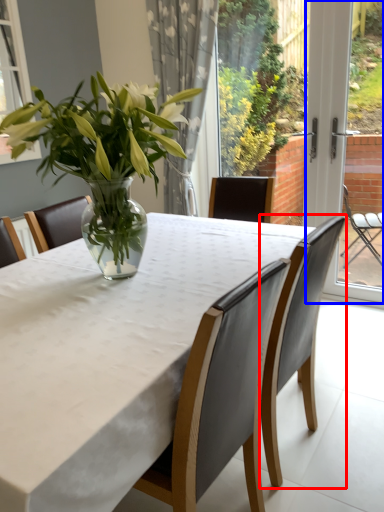
Question: Among these objects, which one is farthest to the camera, chair (highlighted by a red box) or screen door (highlighted by a blue box)?

Choices:
 (A) chair
 (B) screen door

Answer: (B)